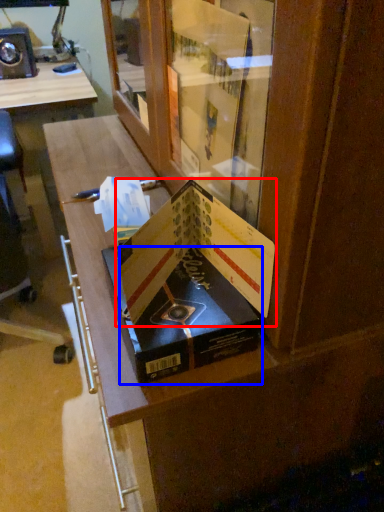
Question: Which object is closer to the camera taking this photo, paperback book (highlighted by a red box) or paperback book (highlighted by a blue box)?

Choices:
 (A) paperback book
 (B) paperback book

Answer: (A)